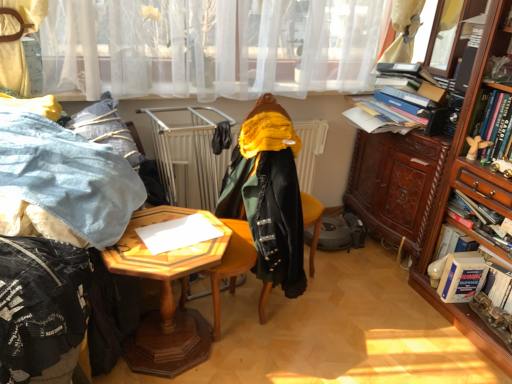
Question: Is wooden cabinet at right, acting as the 1th cabinetry starting from the front, aimed at hardcover book at right, which is the 4th book in bottom-to-top order?

Choices:
 (A) no
 (B) yes

Answer: (B)

Question: Is wooden cabinet at right, acting as the 1th cabinetry starting from the front, far from hardcover book at right, the 1th book from the top?

Choices:
 (A) no
 (B) yes

Answer: (A)

Question: From a real-world perspective, is wooden cabinet at right, acting as the 1th cabinetry starting from the front, located higher than hardcover book at right, the 1th book from the top?

Choices:
 (A) no
 (B) yes

Answer: (A)

Question: From the image's perspective, would you say wooden cabinet at right, acting as the 1th cabinetry starting from the front, is shown under hardcover book at right, the 1th book from the top?

Choices:
 (A) yes
 (B) no

Answer: (A)

Question: From a real-world perspective, is wooden cabinet at right, marked as the second cabinetry in a back-to-front arrangement, located beneath hardcover book at right, which is the 4th book in bottom-to-top order?

Choices:
 (A) no
 (B) yes

Answer: (B)

Question: Which is correct: velvet black coat at center is inside wooden cabinet at right, acting as the 1th cabinetry starting from the front, or outside of it?

Choices:
 (A) outside
 (B) inside

Answer: (A)

Question: Would you say velvet black coat at center is to the left or to the right of wooden cabinet at right, acting as the 1th cabinetry starting from the front, in the picture?

Choices:
 (A) left
 (B) right

Answer: (A)

Question: Is velvet black coat at center wider or thinner than wooden cabinet at right, acting as the 1th cabinetry starting from the front?

Choices:
 (A) wide
 (B) thin

Answer: (B)

Question: From the image's perspective, is velvet black coat at center positioned above or below wooden cabinet at right, marked as the second cabinetry in a back-to-front arrangement?

Choices:
 (A) above
 (B) below

Answer: (B)

Question: In terms of height, does velvet-like green coat at center look taller or shorter compared to hardcover book at right, which is the 4th book in bottom-to-top order?

Choices:
 (A) short
 (B) tall

Answer: (B)

Question: In terms of width, does velvet-like green coat at center look wider or thinner when compared to hardcover book at right, the 1th book from the top?

Choices:
 (A) wide
 (B) thin

Answer: (A)

Question: Considering the positions of point (275, 281) and point (508, 150), is point (275, 281) closer or farther from the camera than point (508, 150)?

Choices:
 (A) farther
 (B) closer

Answer: (A)

Question: Choose the correct answer: Is velvet-like green coat at center inside hardcover book at right, the 1th book from the top, or outside it?

Choices:
 (A) outside
 (B) inside

Answer: (A)

Question: From the image's perspective, is wooden hexagonal table at center above or below velvet black coat at center?

Choices:
 (A) above
 (B) below

Answer: (B)

Question: Is wooden hexagonal table at center wider or thinner than velvet black coat at center?

Choices:
 (A) wide
 (B) thin

Answer: (A)